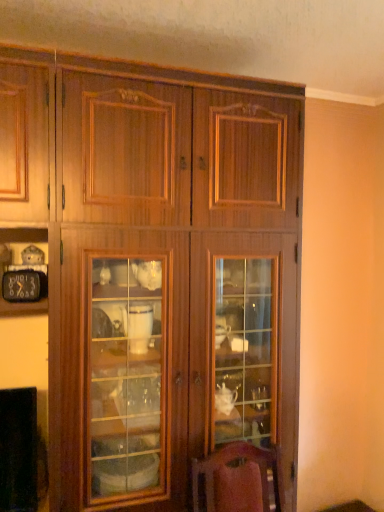
Question: From the image's perspective, is wooden cabinet at center located above or below metallic black clock at left?

Choices:
 (A) below
 (B) above

Answer: (A)

Question: Is wooden cabinet at center in front of or behind metallic black clock at left in the image?

Choices:
 (A) behind
 (B) front

Answer: (B)

Question: Is wooden cabinet at center taller or shorter than metallic black clock at left?

Choices:
 (A) tall
 (B) short

Answer: (A)

Question: From the image's perspective, is metallic black clock at left located above or below wooden cabinet at center?

Choices:
 (A) above
 (B) below

Answer: (A)

Question: Does point (36, 295) appear closer or farther from the camera than point (271, 330)?

Choices:
 (A) farther
 (B) closer

Answer: (B)

Question: Is metallic black clock at left spatially inside wooden cabinet at center, or outside of it?

Choices:
 (A) inside
 (B) outside

Answer: (A)

Question: Considering their positions, is metallic black clock at left located in front of or behind wooden cabinet at center?

Choices:
 (A) front
 (B) behind

Answer: (B)